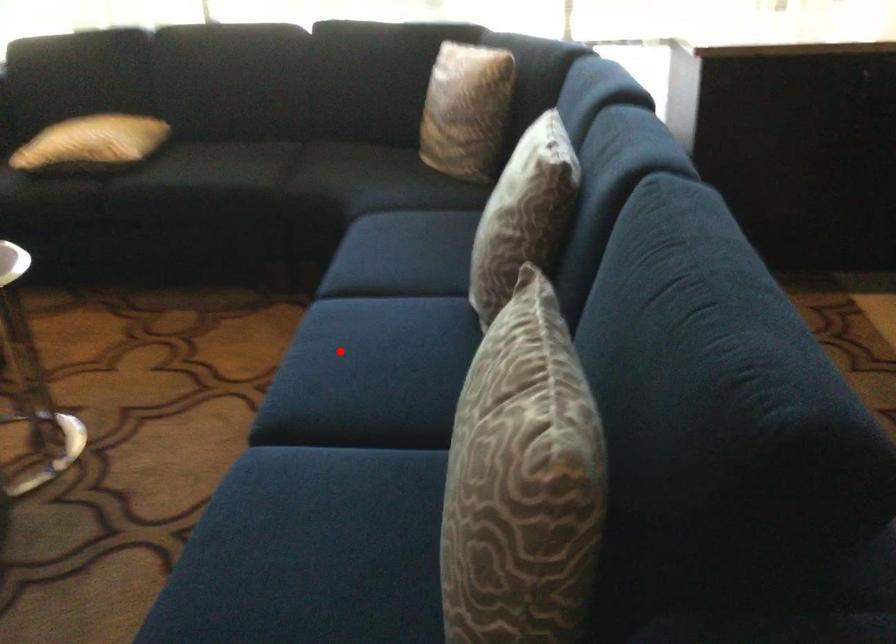
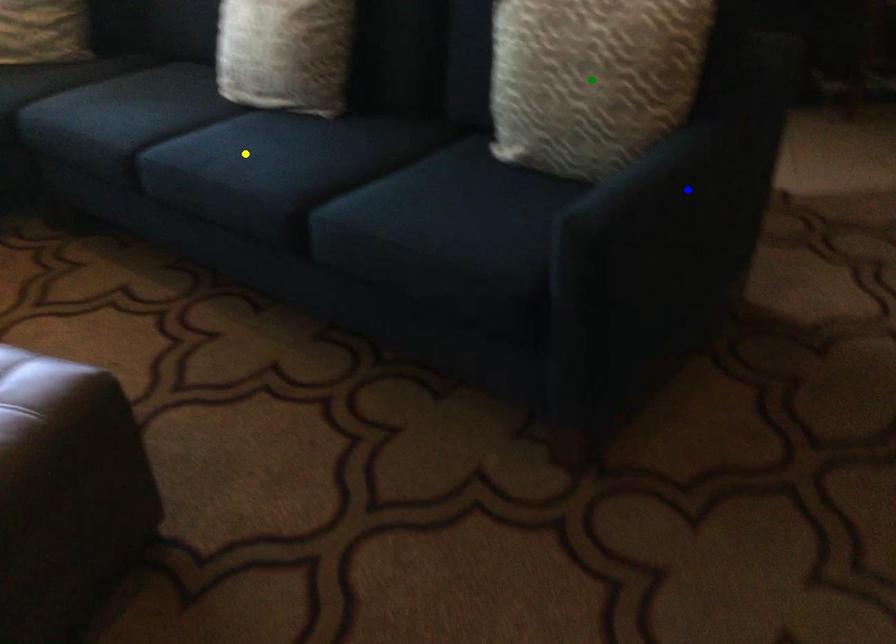
Question: I am providing you with two images of the same scene from different viewpoints. A red point is marked on the first image. You are given multiple points on the second image. Which spot in image 2 lines up with the point in image 1?

Choices:
 (A) green point
 (B) blue point
 (C) yellow point

Answer: (C)